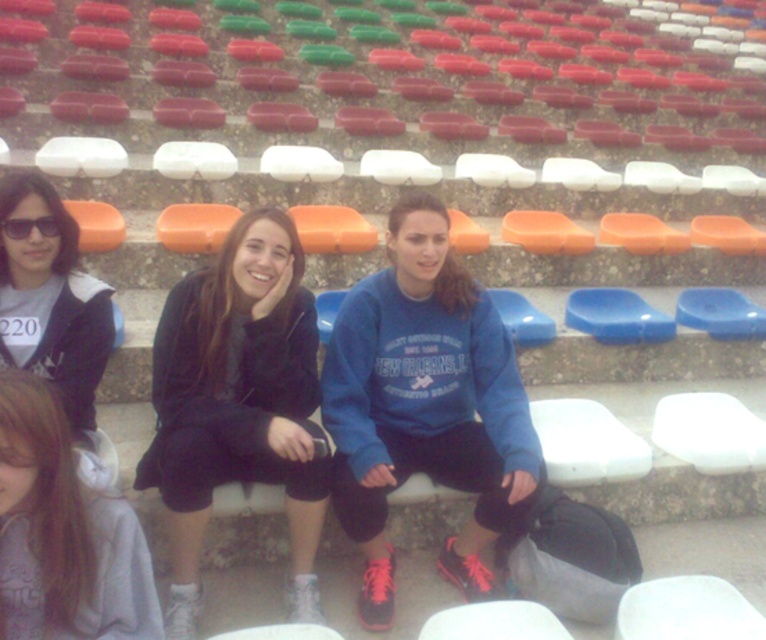
Image resolution: width=766 pixels, height=640 pixels. What are the coordinates of `matte black jacket at left` in the screenshot? It's located at (51, 296).

Does point (38, 308) come farther from viewer compared to point (31, 228)?

Yes, point (38, 308) is behind point (31, 228).

In order to click on matte black jacket at left in this screenshot , I will do `click(51, 296)`.

Can you confirm if blue fleece sweatshirt at center is smaller than gray fleece hoodie at lower left?

No, blue fleece sweatshirt at center is not smaller than gray fleece hoodie at lower left.

Is point (480, 317) less distant than point (90, 515)?

No, it is behind (90, 515).

Is point (499, 422) closer to camera compared to point (64, 616)?

No, (499, 422) is behind (64, 616).

Where is `blue fleece sweatshirt at center`? Image resolution: width=766 pixels, height=640 pixels. blue fleece sweatshirt at center is located at coordinates (424, 404).

Identify the location of black matte jacket at center. (237, 403).

Is point (286, 388) positioned behind point (35, 193)?

Yes, point (286, 388) is behind point (35, 193).

The height and width of the screenshot is (640, 766). Describe the element at coordinates (237, 403) in the screenshot. I see `black matte jacket at center` at that location.

The width and height of the screenshot is (766, 640). I want to click on black matte jacket at center, so click(237, 403).